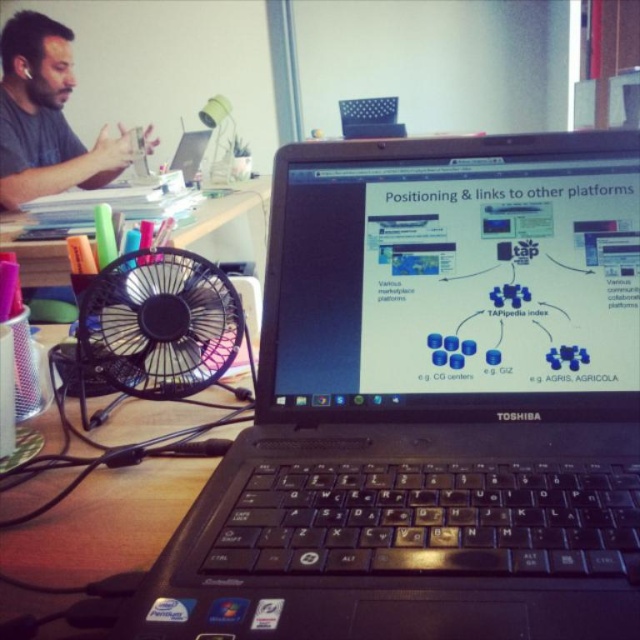
What are the coordinates of the black plastic fan at lower left?

The black plastic fan at lower left is located at coordinates point [160,328].

You are organizing the workspace and need to place both the black plastic fan at lower left and the black plastic fan at left on a shelf. Which fan should you place first if you want to arrange them from shortest to tallest?

The black plastic fan at lower left is shorter than the black plastic fan at left, so you should place the black plastic fan at lower left first when arranging from shortest to tallest.

You are organizing a presentation and need to place a water bottle between the black plastic fan at lower left and the matte black laptop at upper left. Considering their widths, will the bottle fit comfortably between them?

The black plastic fan at lower left is narrower than the matte black laptop at upper left. Since the fan is narrower, there should be enough space between them to place the water bottle comfortably.